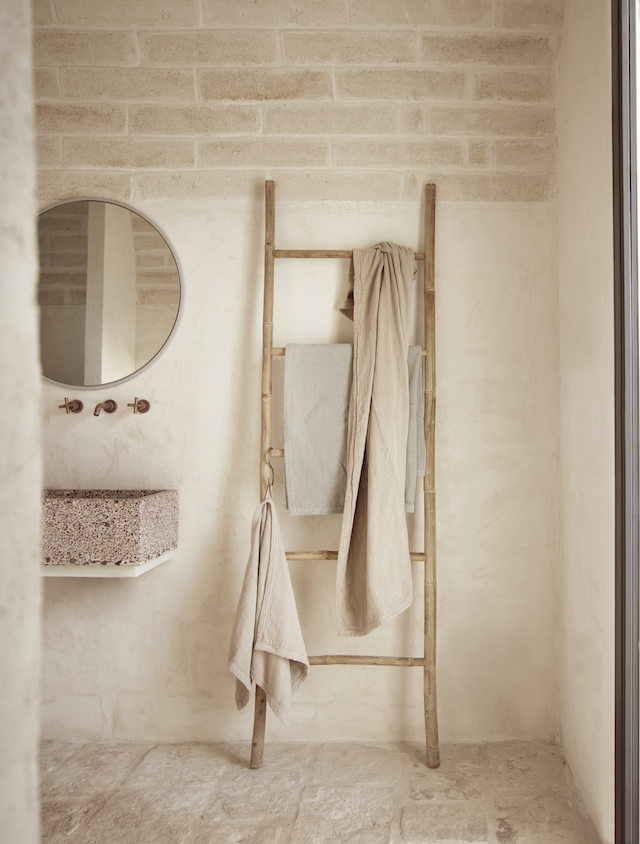
The width and height of the screenshot is (640, 844). Find the location of `right faucet`. right faucet is located at coordinates (136, 403).